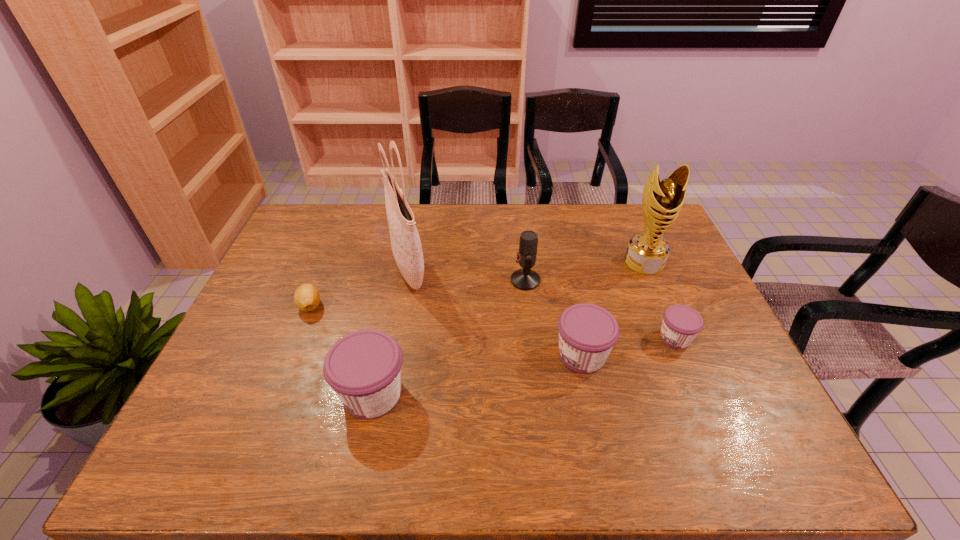
Locate an element on the screen. This screenshot has width=960, height=540. free space that satisfies the following two spatial constraints: 1. on the front-facing side of the award; 2. on the side of the third tallest object with the red ring is located at coordinates (652, 280).